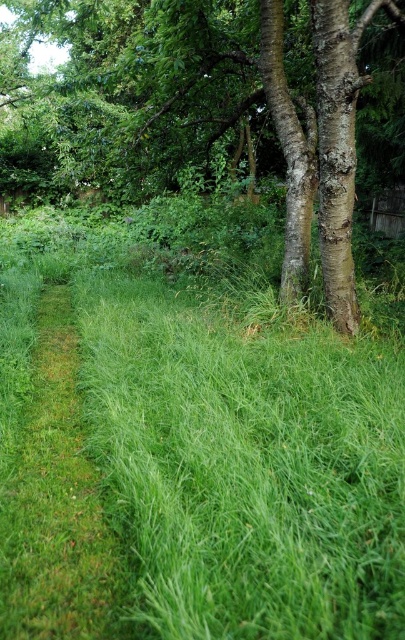
How far apart are green grassy at center and smooth bark tree at center?

green grassy at center is 3.12 meters from smooth bark tree at center.

Does green grassy at center have a lesser width compared to smooth bark tree at center?

Indeed, green grassy at center has a lesser width compared to smooth bark tree at center.

Which is in front, point (353, 573) or point (298, 227)?

Positioned in front is point (353, 573).

At what (x,y) coordinates should I click in order to perform the action: click on green grassy at center. Please return your answer as a coordinate pair (x, y). The width and height of the screenshot is (405, 640). Looking at the image, I should click on (202, 436).